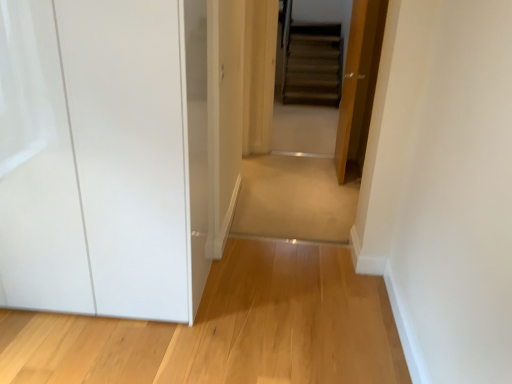
At what (x,y) coordinates should I click in order to perform the action: click on vacant space in front of transparent glossy cabinet at left. Please return your answer as a coordinate pair (x, y). This screenshot has height=384, width=512. Looking at the image, I should click on (66, 342).